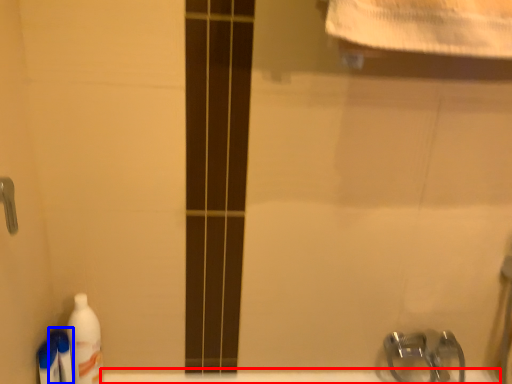
Question: Which object appears farthest to the camera in this image, bath (highlighted by a red box) or cleaning product (highlighted by a blue box)?

Choices:
 (A) bath
 (B) cleaning product

Answer: (A)